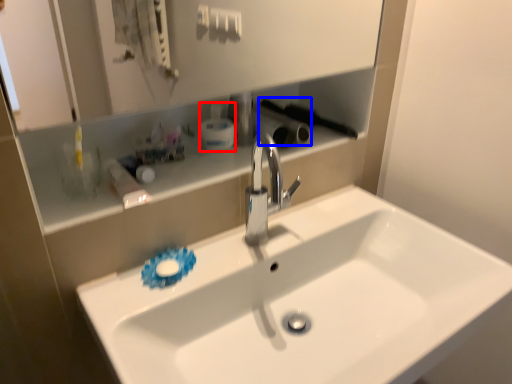
Question: Which object appears closest to the camera in this image, mouthwash (highlighted by a red box) or brush (highlighted by a blue box)?

Choices:
 (A) mouthwash
 (B) brush

Answer: (A)